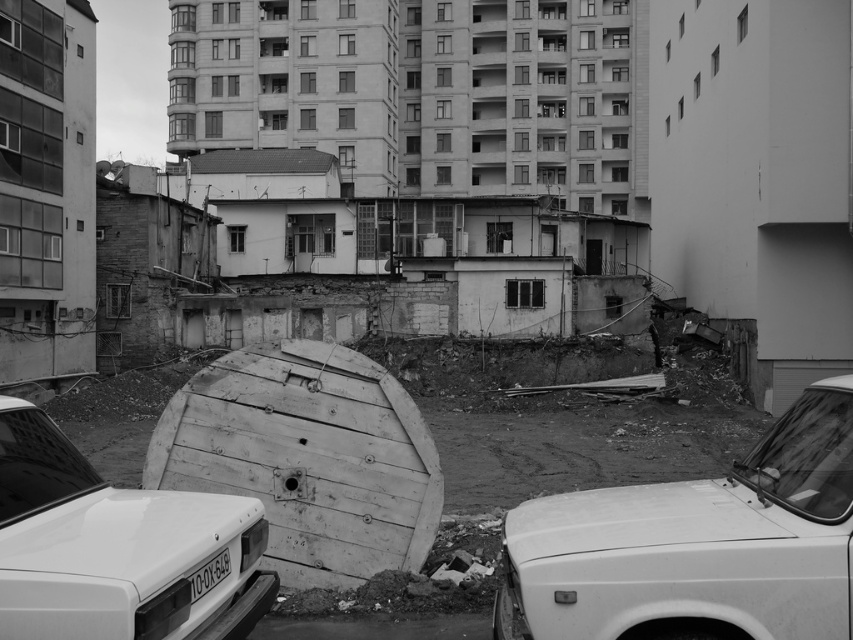
From the picture: Who is lower down, white matte car at center or white plastic license plate at lower center?

white plastic license plate at lower center

Is white matte car at center positioned at the back of white plastic license plate at lower center?

No, it is not.

What are the coordinates of `white matte car at center` in the screenshot? It's located at (114, 547).

Where is `white matte car at center`? white matte car at center is located at coordinates (114, 547).

Can you confirm if white matte car at lower right is smaller than white matte car at center?

Actually, white matte car at lower right might be larger than white matte car at center.

Does point (709, 554) come behind point (96, 618)?

Yes, it is.

The height and width of the screenshot is (640, 853). I want to click on white matte car at lower right, so click(x=697, y=545).

Is white matte car at lower right to the right of wooden barrel at center from the viewer's perspective?

Yes, white matte car at lower right is to the right of wooden barrel at center.

Who is more distant from viewer, (x=579, y=506) or (x=345, y=422)?

Positioned behind is point (x=345, y=422).

Image resolution: width=853 pixels, height=640 pixels. What do you see at coordinates (697, 545) in the screenshot?
I see `white matte car at lower right` at bounding box center [697, 545].

This screenshot has height=640, width=853. Identify the location of white matte car at lower right. (697, 545).